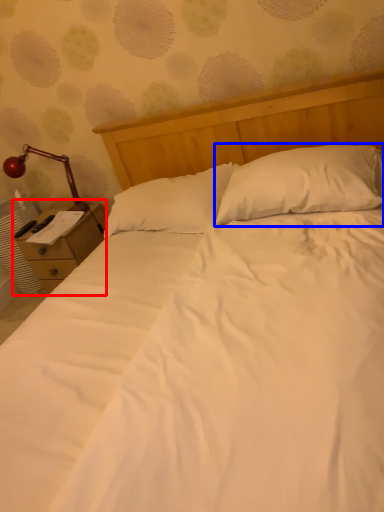
Question: Which object is further to the camera taking this photo, nightstand (highlighted by a red box) or pillow (highlighted by a blue box)?

Choices:
 (A) nightstand
 (B) pillow

Answer: (A)